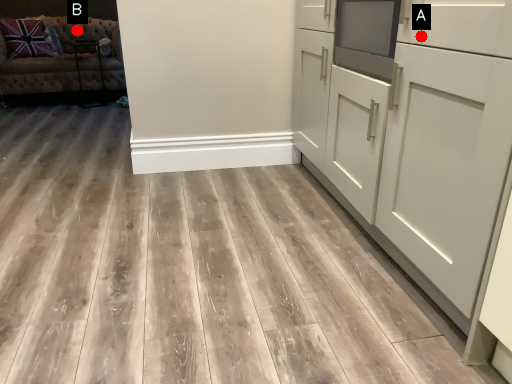
Question: Two points are circled on the image, labeled by A and B beside each circle. Which point is closer to the camera?

Choices:
 (A) A is closer
 (B) B is closer

Answer: (A)